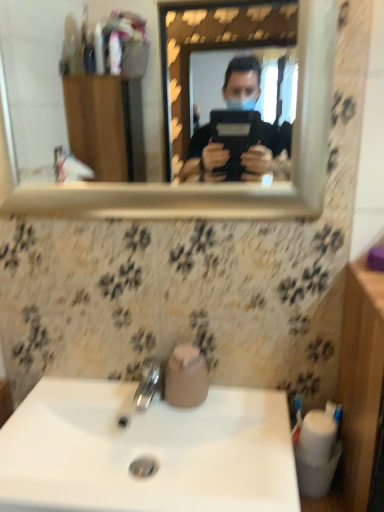
Image resolution: width=384 pixels, height=512 pixels. In order to click on free space that is to the left of pink matte toilet paper at sink in this screenshot , I will do `click(104, 398)`.